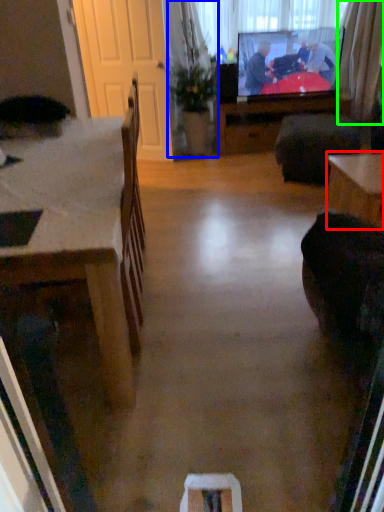
Question: Estimate the real-world distances between objects in this image. Which object is farther from table (highlighted by a red box), houseplant (highlighted by a blue box) or curtain (highlighted by a green box)?

Choices:
 (A) houseplant
 (B) curtain

Answer: (B)